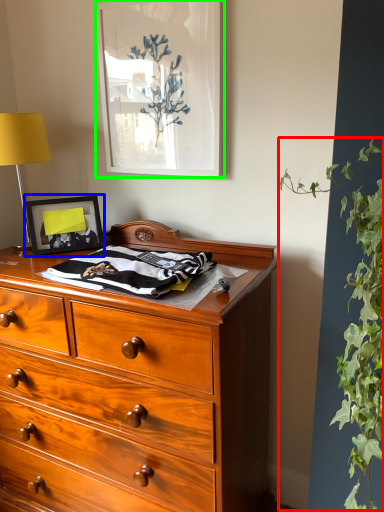
Question: Estimate the real-world distances between objects in this image. Which object is farther from vegetation (highlighted by a red box), picture frame (highlighted by a blue box) or picture frame (highlighted by a green box)?

Choices:
 (A) picture frame
 (B) picture frame

Answer: (A)